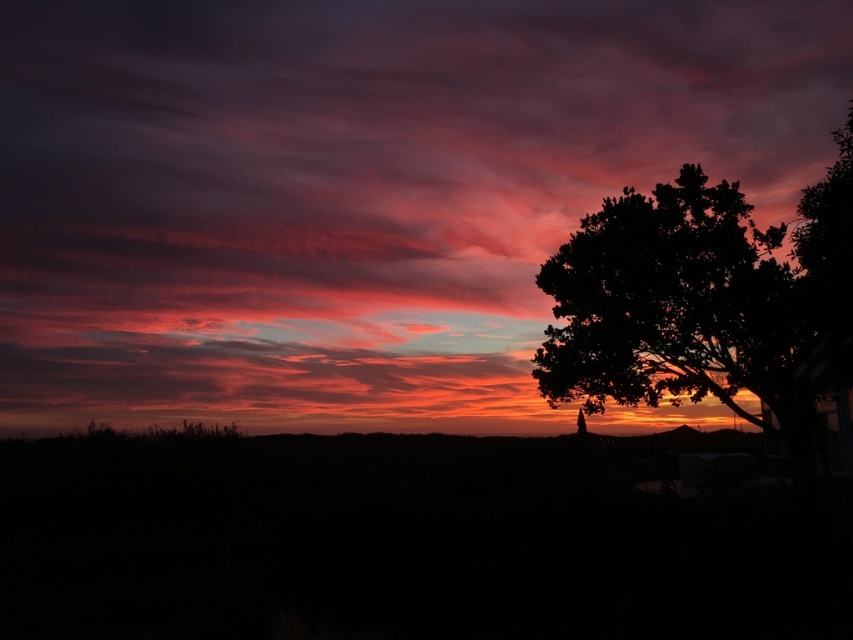
Can you confirm if matte pink cloud at upper center is smaller than silhouette tree at right?

Actually, matte pink cloud at upper center might be larger than silhouette tree at right.

Can you confirm if matte pink cloud at upper center is positioned to the left of silhouette tree at right?

Indeed, matte pink cloud at upper center is positioned on the left side of silhouette tree at right.

Between point (372, 227) and point (622, 326), which one is positioned behind?

The point (372, 227) is behind.

Find the location of `matte pink cloud at upper center`. matte pink cloud at upper center is located at coordinates (357, 192).